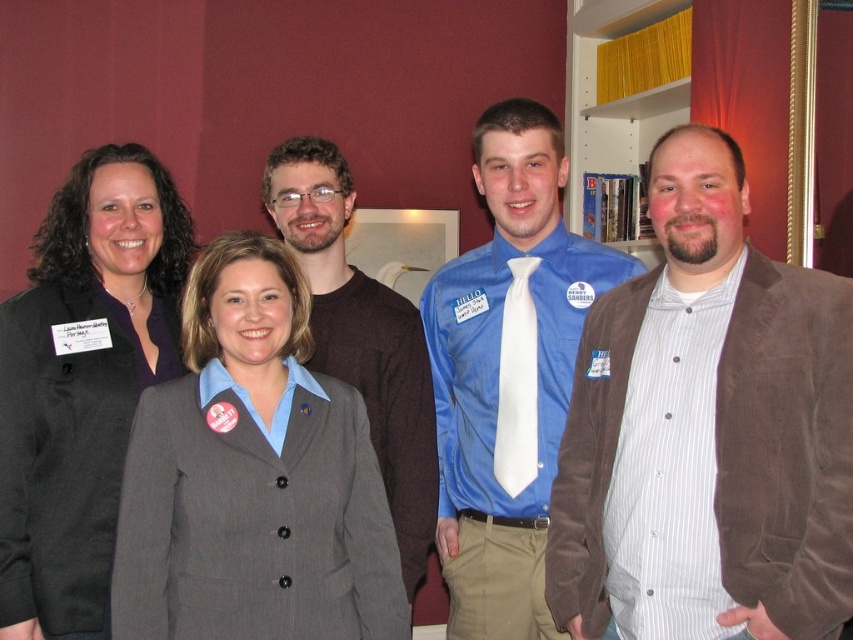
Based on the coordinates provided, which object is located at point (252, 476) in the image?

The point (252, 476) corresponds to the gray wool suit at center.